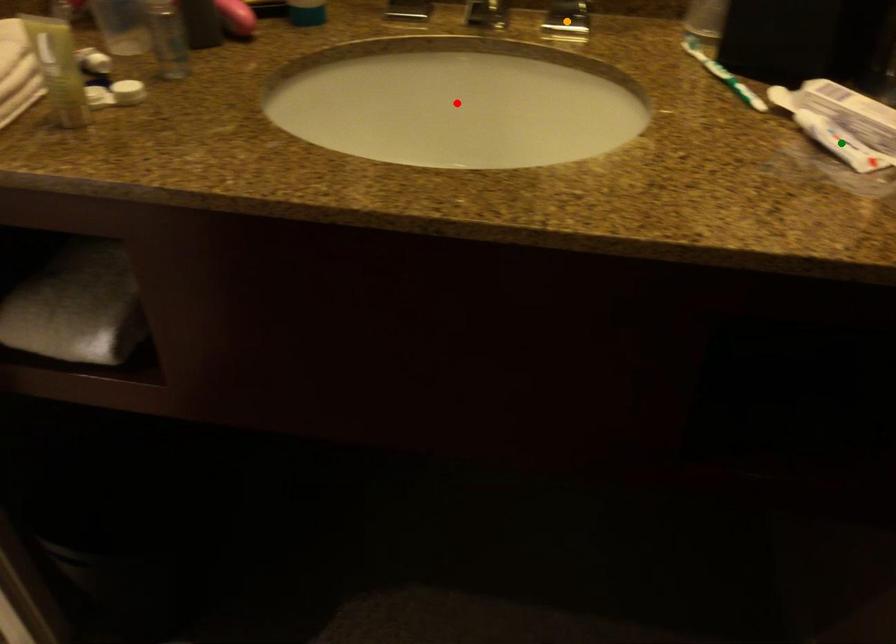
Order these from nearest to farthest:
red point | green point | orange point

green point, orange point, red point